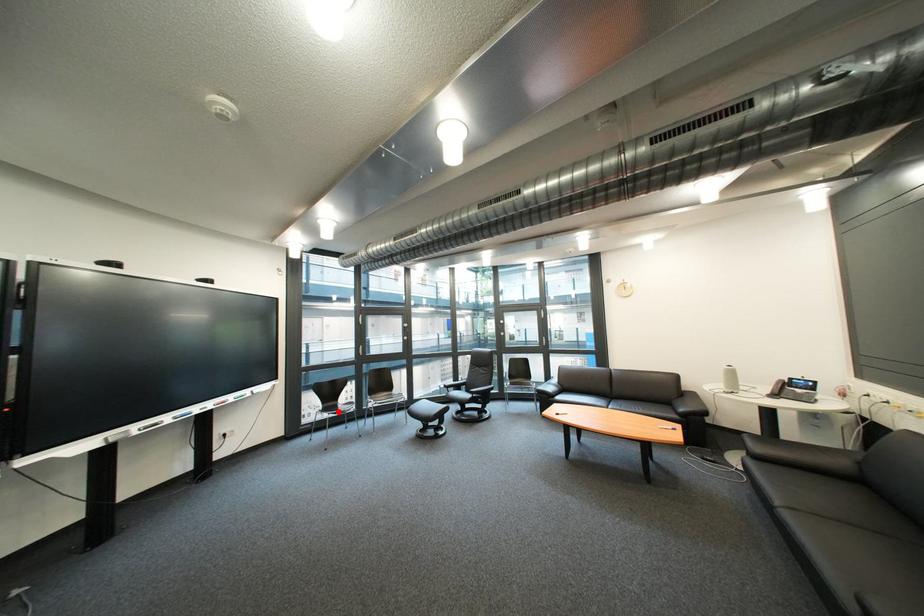
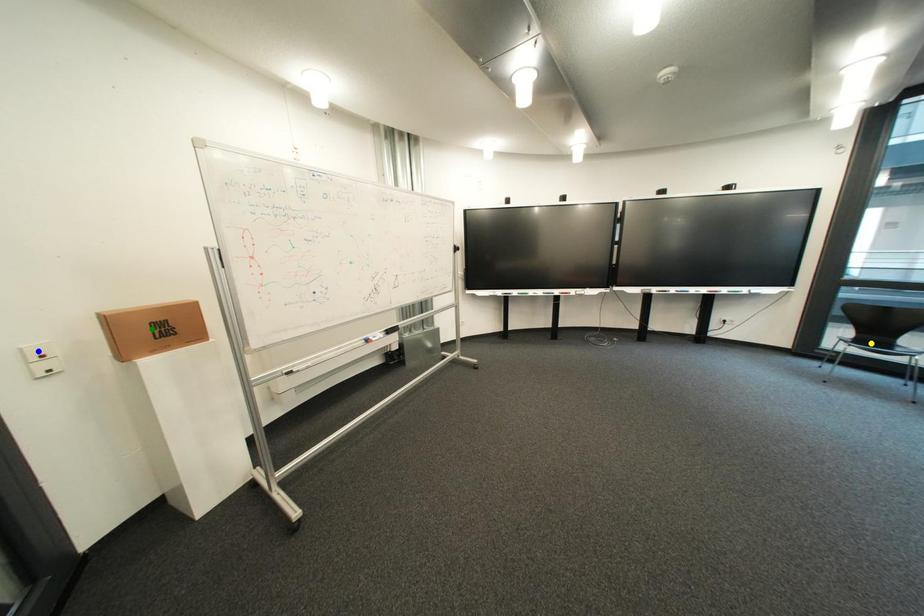
Question: I am providing you with two images of the same scene from different viewpoints. A red point is marked on the first image. You are given multiple points on the second image. Can you choose the point in image 2 that corresponds to the point in image 1?

Choices:
 (A) yellow point
 (B) blue point
 (C) green point

Answer: (A)